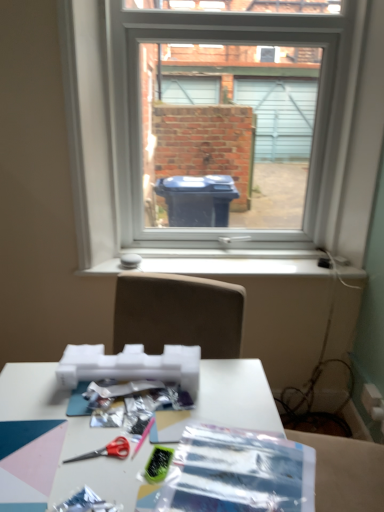
Question: From the image's perspective, is white matte table at lower center on top of white plastic window at center?

Choices:
 (A) yes
 (B) no

Answer: (B)

Question: From a real-world perspective, is white matte table at lower center physically below white plastic window at center?

Choices:
 (A) yes
 (B) no

Answer: (A)

Question: Can white plastic window at center be found inside white matte table at lower center?

Choices:
 (A) no
 (B) yes

Answer: (A)

Question: Considering the relative sizes of white matte table at lower center and white plastic window at center in the image provided, is white matte table at lower center thinner than white plastic window at center?

Choices:
 (A) yes
 (B) no

Answer: (B)

Question: Does white matte table at lower center lie behind white plastic window at center?

Choices:
 (A) yes
 (B) no

Answer: (B)

Question: Is white plastic window sill at center taller or shorter than white matte table at lower center?

Choices:
 (A) tall
 (B) short

Answer: (B)

Question: Considering their positions, is white plastic window sill at center located in front of or behind white matte table at lower center?

Choices:
 (A) behind
 (B) front

Answer: (A)

Question: Considering the positions of point tap(223, 258) and point tap(59, 483), is point tap(223, 258) closer or farther from the camera than point tap(59, 483)?

Choices:
 (A) closer
 (B) farther

Answer: (B)

Question: From a real-world perspective, is white plastic window sill at center positioned above or below white matte table at lower center?

Choices:
 (A) above
 (B) below

Answer: (A)

Question: Is white plastic window at center in front of or behind translucent plastic wrapping paper at center in the image?

Choices:
 (A) front
 (B) behind

Answer: (B)

Question: In terms of size, does white plastic window at center appear bigger or smaller than translucent plastic wrapping paper at center?

Choices:
 (A) big
 (B) small

Answer: (A)

Question: Is point (296, 234) closer or farther from the camera than point (266, 445)?

Choices:
 (A) closer
 (B) farther

Answer: (B)

Question: From the image's perspective, relative to translucent plastic wrapping paper at center, is white plastic window at center above or below?

Choices:
 (A) above
 (B) below

Answer: (A)

Question: In the image, is red plastic scissors at lower center on the left side or the right side of white plastic window sill at center?

Choices:
 (A) right
 (B) left

Answer: (B)

Question: Looking at their shapes, would you say red plastic scissors at lower center is wider or thinner than white plastic window sill at center?

Choices:
 (A) thin
 (B) wide

Answer: (A)